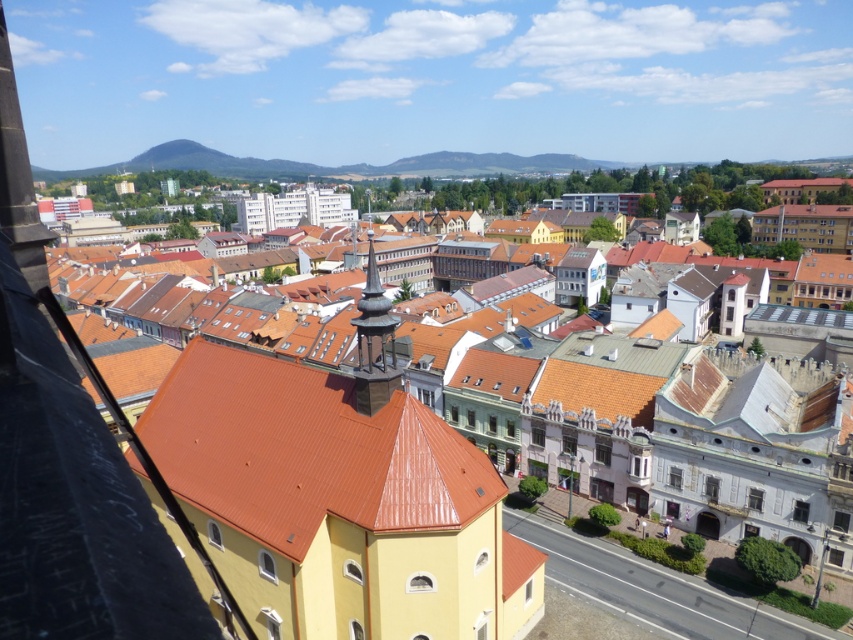
Question: Which of these objects is positioned closest to the yellow matte church at center?

Choices:
 (A) shiny copper spire at center
 (B) brown tile roof at center

Answer: (B)

Question: Which object is the closest to the yellow matte church at center?

Choices:
 (A) brown tile roof at center
 (B) shiny copper spire at center

Answer: (A)

Question: Observing the image, what is the correct spatial positioning of brown tile roof at center in reference to shiny copper spire at center?

Choices:
 (A) below
 (B) above

Answer: (A)

Question: Which point appears closest to the camera in this image?

Choices:
 (A) [x=363, y=342]
 (B) [x=804, y=525]

Answer: (A)

Question: Does brown tile roof at center have a lesser width compared to shiny copper spire at center?

Choices:
 (A) no
 (B) yes

Answer: (A)

Question: Considering the relative positions of yellow matte church at center and shiny copper spire at center in the image provided, where is yellow matte church at center located with respect to shiny copper spire at center?

Choices:
 (A) right
 (B) left

Answer: (A)